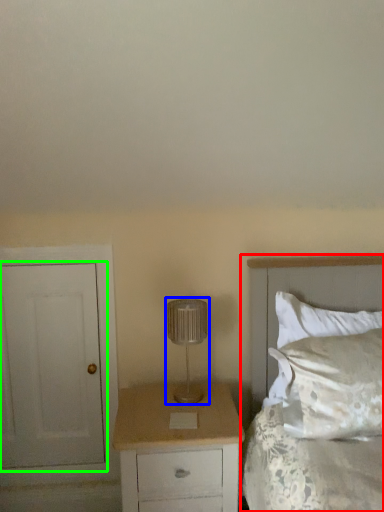
Question: Estimate the real-world distances between objects in this image. Which object is farther from bed (highlighted by a red box), lamp (highlighted by a blue box) or door (highlighted by a green box)?

Choices:
 (A) lamp
 (B) door

Answer: (B)